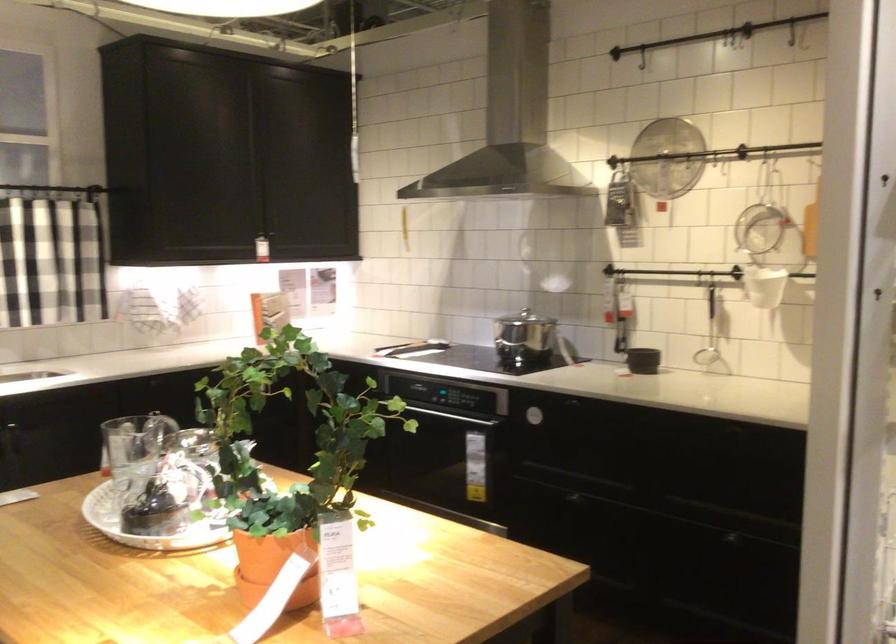
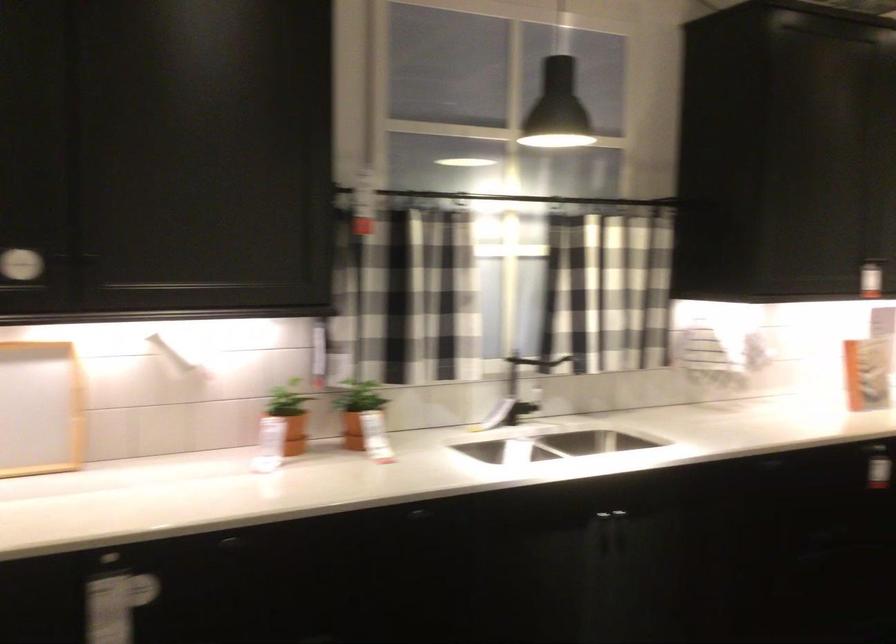
In a continuous first-person perspective shot, in which direction is the camera moving?

The cameraman moved toward left, forward.